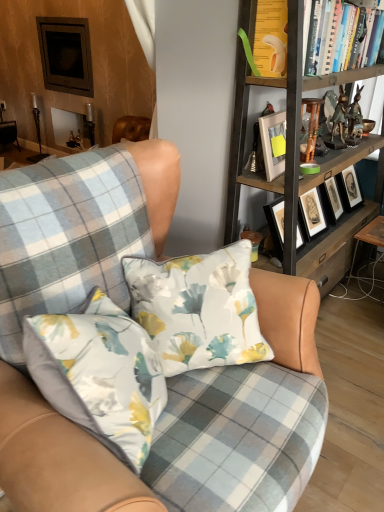
Question: Is white matte picture frame at upper center inside or outside of wooden bookshelf at upper right?

Choices:
 (A) inside
 (B) outside

Answer: (A)

Question: Based on their positions, is white matte picture frame at upper center located to the left or right of wooden bookshelf at upper right?

Choices:
 (A) right
 (B) left

Answer: (B)

Question: Considering the real-world distances, which object is farthest from the white matte picture frame at upper center?

Choices:
 (A) plaid fabric chair at center
 (B) floral fabric pillow at center
 (C) wooden table at lower right
 (D) wooden bookshelf at upper right
 (E) hardcover books at upper right

Answer: (A)

Question: Which object is positioned farthest from the wooden table at lower right?

Choices:
 (A) wooden bookshelf at upper right
 (B) white matte picture frame at upper center
 (C) plaid fabric chair at center
 (D) hardcover books at upper right
 (E) floral fabric pillow at center

Answer: (C)